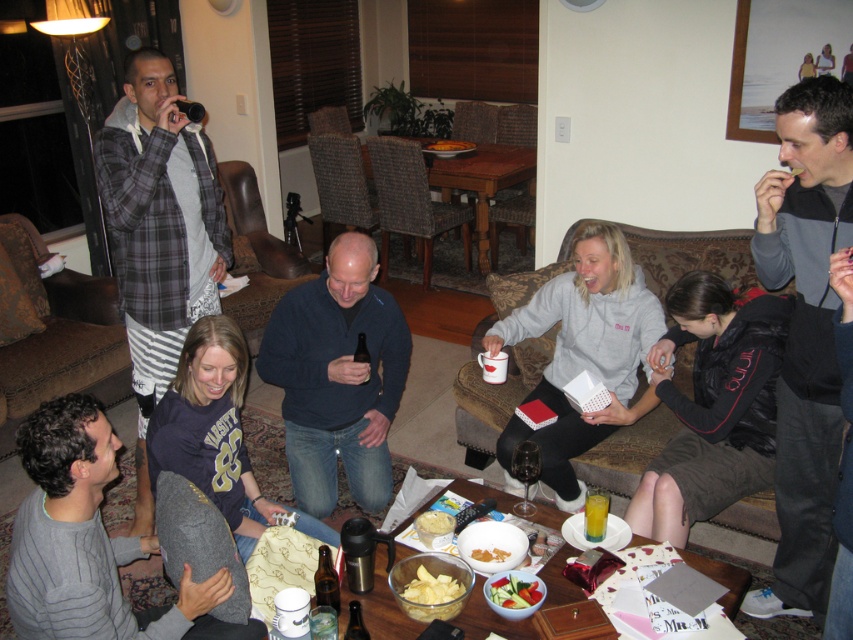
Can you confirm if gray sweater at lower left is shorter than black matte jacket at lower right?

Yes.

Is point (35, 428) closer to viewer compared to point (697, 417)?

Yes.

The height and width of the screenshot is (640, 853). I want to click on gray sweater at lower left, so click(90, 541).

Where is `gray sweater at lower left`? gray sweater at lower left is located at coordinates (90, 541).

Is point (735, 461) farther from camera compared to point (538, 596)?

Yes, point (735, 461) is farther from viewer.

Which is more to the right, black matte jacket at lower right or fresh cucumber slices at lower center?

Positioned to the right is black matte jacket at lower right.

What do you see at coordinates (712, 404) in the screenshot? I see `black matte jacket at lower right` at bounding box center [712, 404].

Identify the location of black matte jacket at lower right. The height and width of the screenshot is (640, 853). click(x=712, y=404).

Looking at this image, can you confirm if fresh cucumber slices at lower center is thinner than yellow crumbly cheese at center?

Incorrect, fresh cucumber slices at lower center's width is not less than yellow crumbly cheese at center's.

Is fresh cucumber slices at lower center closer to the viewer compared to yellow crumbly cheese at center?

Result: That is True.

What do you see at coordinates (514, 593) in the screenshot?
I see `fresh cucumber slices at lower center` at bounding box center [514, 593].

Identify the location of fresh cucumber slices at lower center. The width and height of the screenshot is (853, 640). (514, 593).